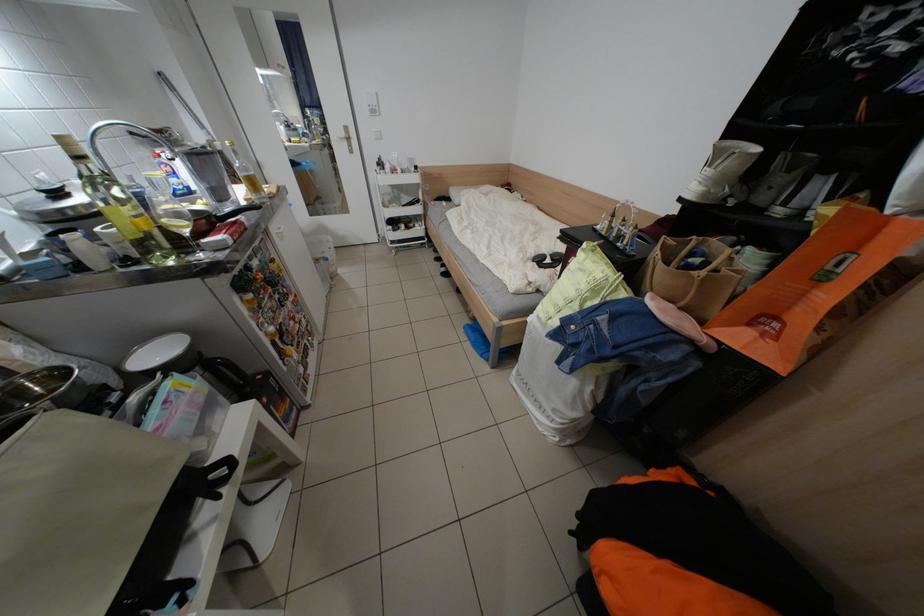
Locate an element on the screen. The image size is (924, 616). pot lid handle is located at coordinates (46, 403).